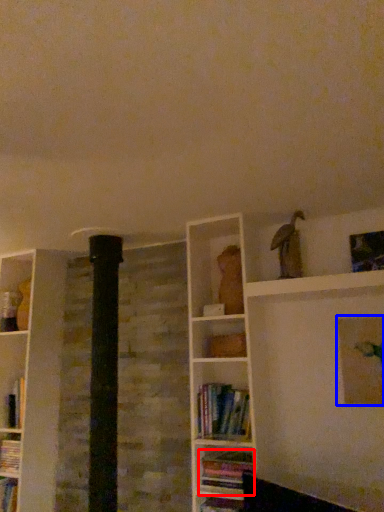
Question: Which of the following is the farthest to the observer, book (highlighted by a red box) or picture frame (highlighted by a blue box)?

Choices:
 (A) book
 (B) picture frame

Answer: (A)